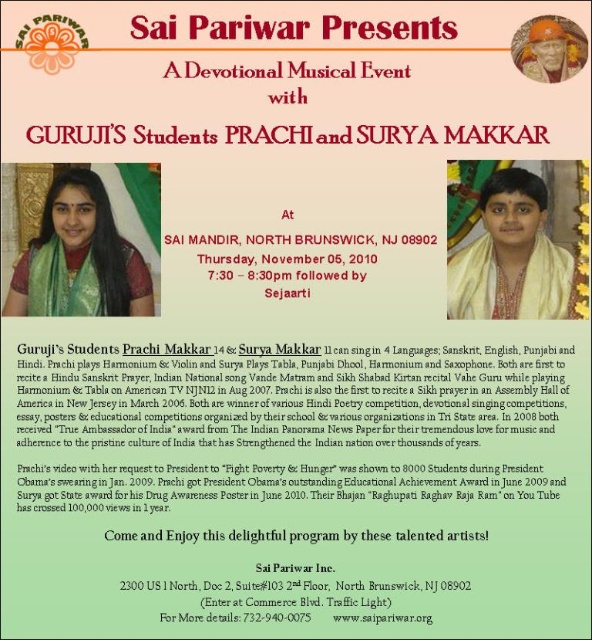
You are standing in front of the promotional poster for the devotional musical event. There are two points on the poster at coordinates point (20, 433) and point (324, 260). Which point is closer to you?

Point (20, 433) is closer to the viewer than point (324, 260).

You are an event planner standing at the entrance of the venue. You need to place a 2 feet wide decorative arch between the green fabric at upper left and the green silk saree at center. Can you fit it without overlapping either object?

The distance between the green fabric at upper left and the green silk saree at center is 5.60 feet. Since the arch is 2 feet wide, there is enough space to place it between them without overlapping either object.